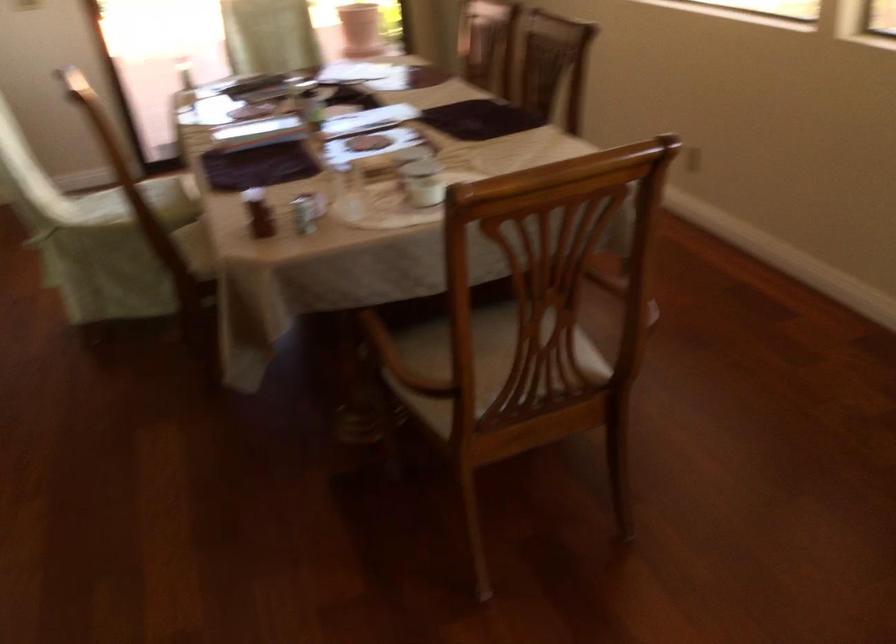
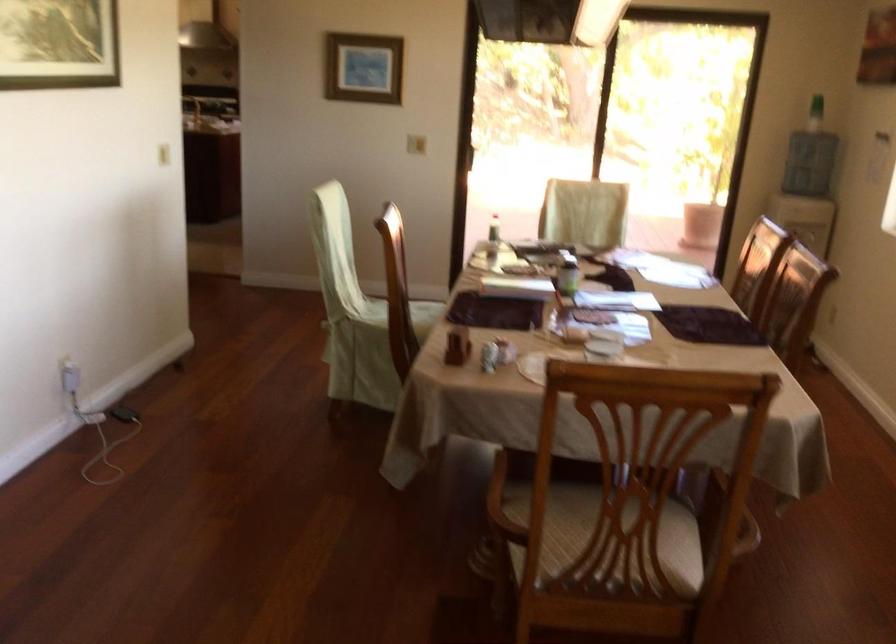
Locate, in the second image, the point that corresponds to (x=255, y=214) in the first image.

(458, 345)